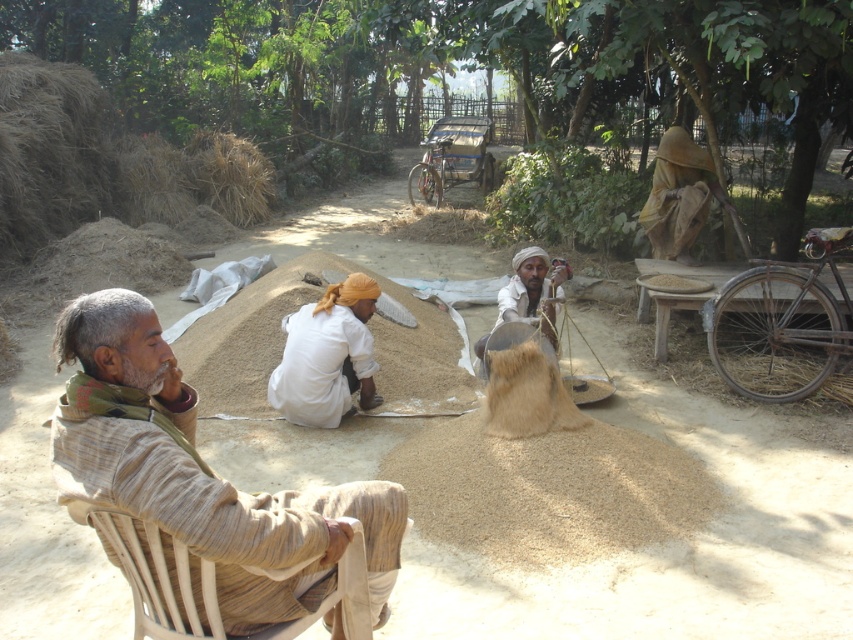
Based on the scene described, which object is shorter between the woven wood chair at left and the light brown fabric at center?

The woven wood chair at left is shorter than the light brown fabric at center.

You are standing at the origin point of the coordinate system in this image. You need to walk to the woven wood chair at left. What direction should you head towards?

Since the woven wood chair at left is located at coordinate point 0.911 on the x axis and 0.250 on the y axis, you should head towards the right and slightly forward to reach it.